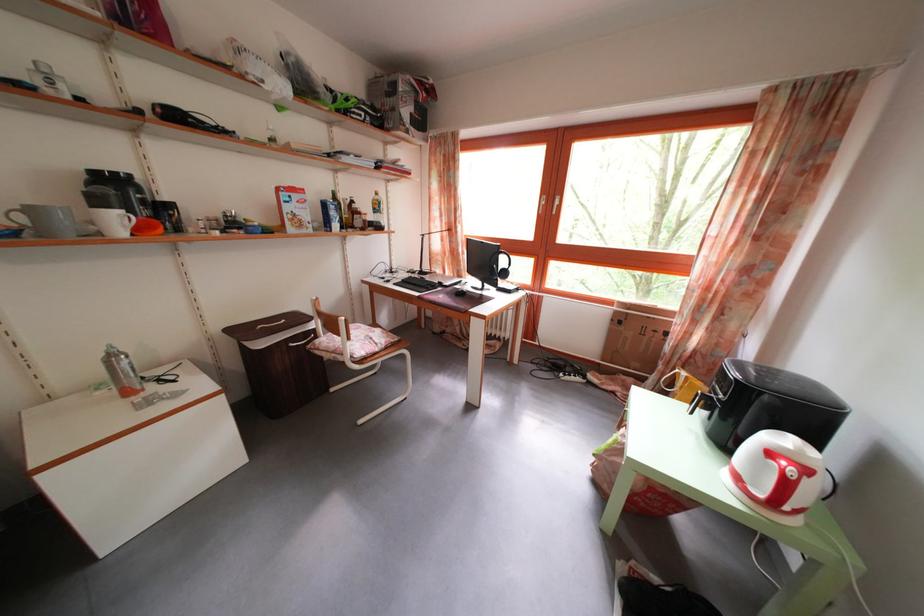
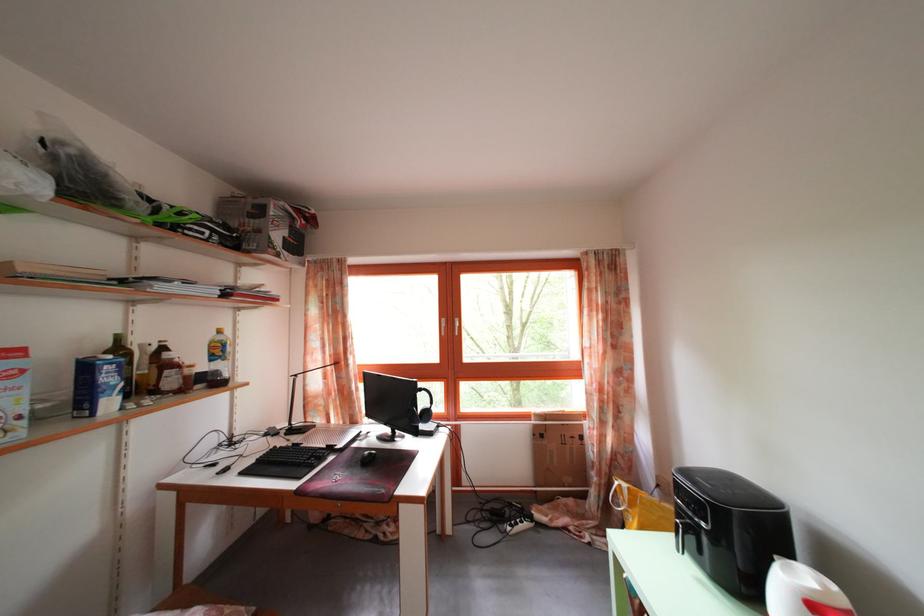
Find the pixel in the second image that matches pixel 342 201 in the first image.

(126, 346)